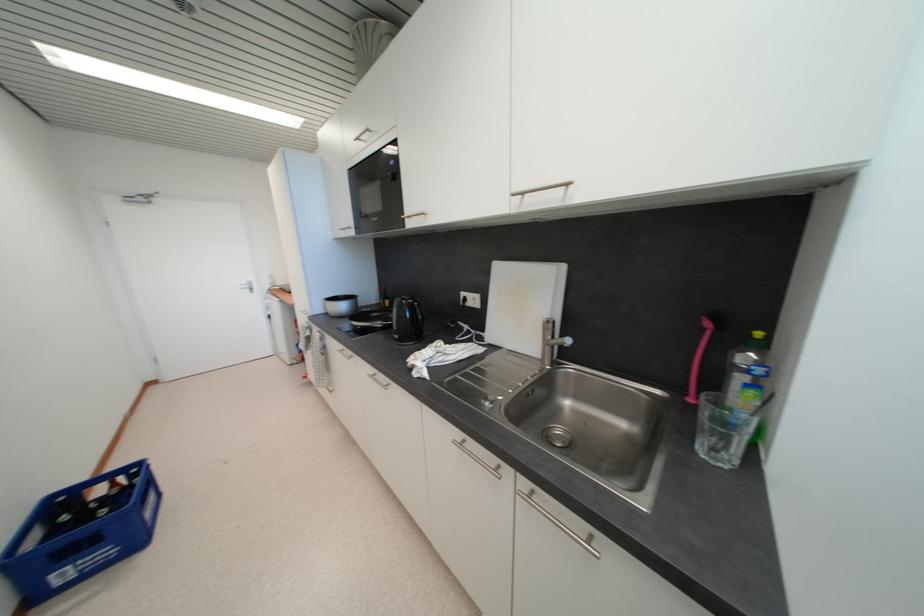
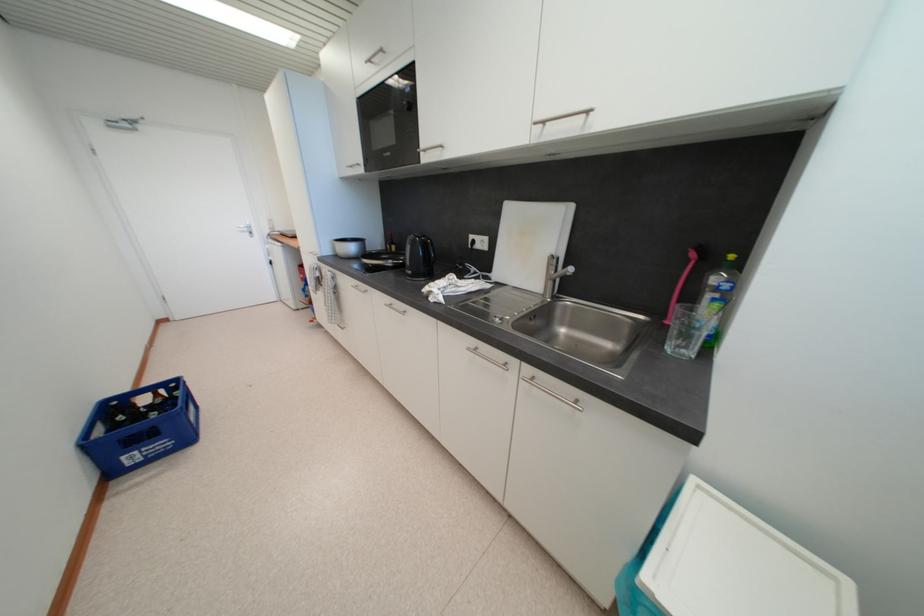
The point at (383, 325) is marked in the first image. Where is the corresponding point in the second image?

(395, 264)